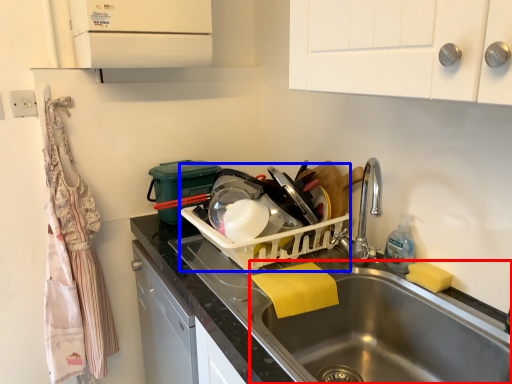
Question: Which object appears farthest to the camera in this image, sink (highlighted by a red box) or appliance (highlighted by a blue box)?

Choices:
 (A) sink
 (B) appliance

Answer: (B)